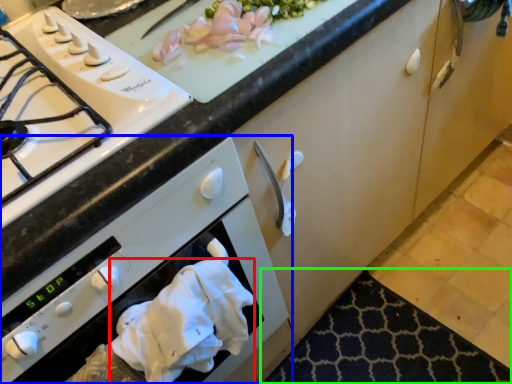
Question: Considering the real-world distances, which object is farthest from hand towel (highlighted by a red box)? oven (highlighted by a blue box) or mat (highlighted by a green box)?

Choices:
 (A) oven
 (B) mat

Answer: (B)